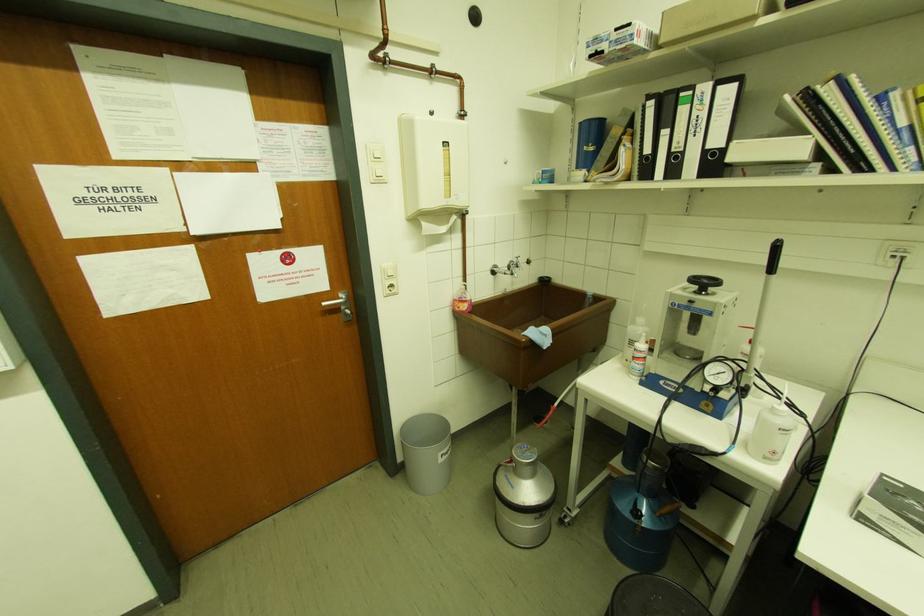
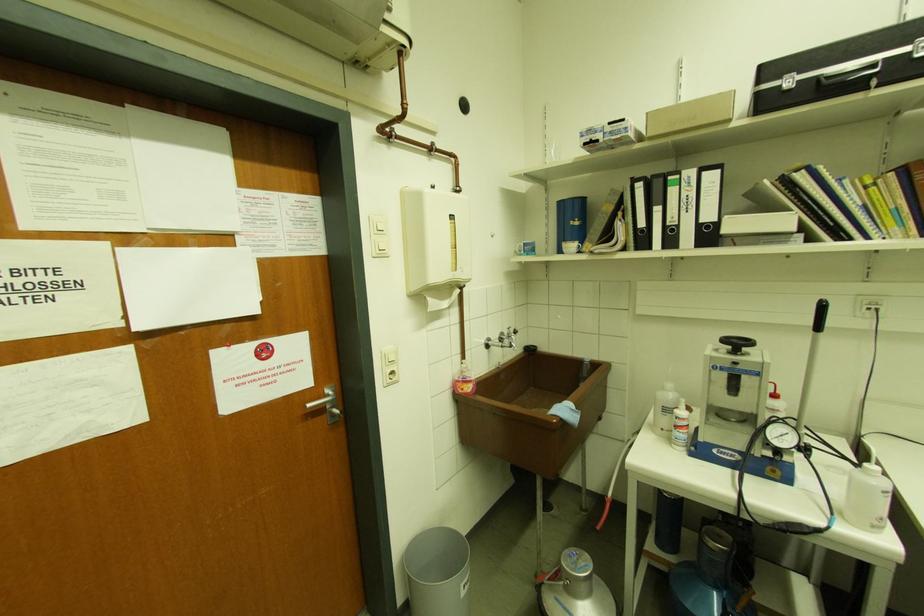
The point at (720, 143) is marked in the first image. Where is the corresponding point in the second image?

(712, 217)